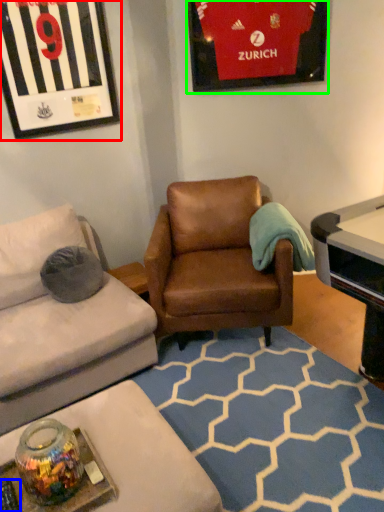
Question: Based on their relative distances, which object is nearer to picture frame (highlighted by a red box)? Choose from remote control (highlighted by a blue box) and picture frame (highlighted by a green box).

Choices:
 (A) remote control
 (B) picture frame

Answer: (B)